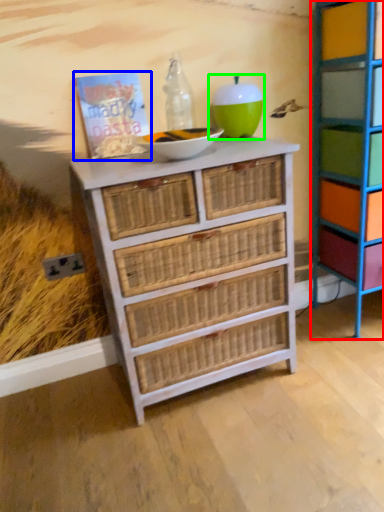
Question: Based on their relative distances, which object is farther from shelf (highlighted by a red box)? Choose from book (highlighted by a blue box) and turquoise (highlighted by a green box).

Choices:
 (A) book
 (B) turquoise

Answer: (A)